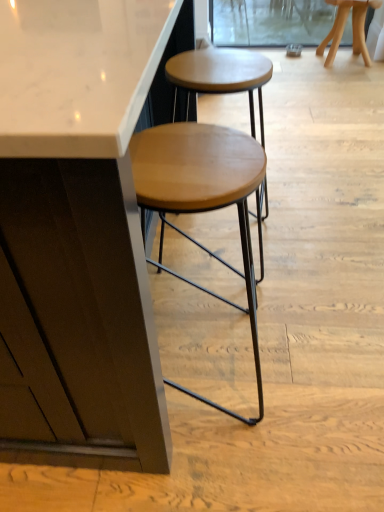
Locate an element on the screen. Image resolution: width=384 pixels, height=512 pixels. vacant space underneath wooden seat at center, the second stool in the right-to-left sequence (from a real-world perspective) is located at coordinates (199, 356).